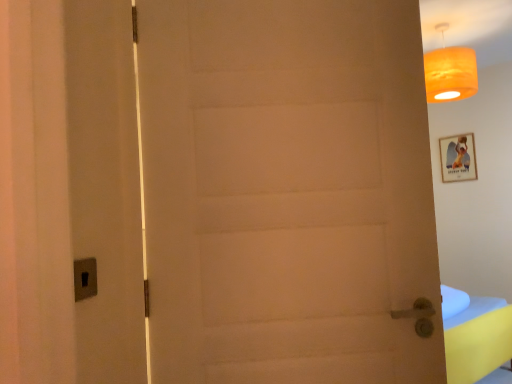
Find the location of a particular element. wooden framed picture at upper right is located at coordinates (458, 158).

This screenshot has height=384, width=512. What are the coordinates of `wooden framed picture at upper right` in the screenshot? It's located at (458, 158).

In the scene shown: Is orange fabric lampshade at upper right at the right side of wooden framed picture at upper right?

Incorrect, orange fabric lampshade at upper right is not on the right side of wooden framed picture at upper right.

Is orange fabric lampshade at upper right in contact with wooden framed picture at upper right?

No, orange fabric lampshade at upper right is not making contact with wooden framed picture at upper right.

The height and width of the screenshot is (384, 512). I want to click on lamp that is in front of the wooden framed picture at upper right, so click(450, 72).

Is orange fabric lampshade at upper right to the right of white matte door at center from the viewer's perspective?

Yes, orange fabric lampshade at upper right is to the right of white matte door at center.

From the image's perspective, would you say orange fabric lampshade at upper right is positioned over white matte door at center?

Yes.

From a real-world perspective, which object rests below the other?

white matte door at center.

Is orange fabric lampshade at upper right in front of or behind white matte door at center in the image?

Clearly, orange fabric lampshade at upper right is behind white matte door at center.

From the picture: Could you tell me if white matte door at center is facing wooden framed picture at upper right?

No, white matte door at center does not turn towards wooden framed picture at upper right.

Does white matte door at center have a lesser width compared to wooden framed picture at upper right?

No, white matte door at center is not thinner than wooden framed picture at upper right.

Is the depth of white matte door at center greater than that of wooden framed picture at upper right?

No, it is in front of wooden framed picture at upper right.

In terms of height, does wooden framed picture at upper right look taller or shorter compared to orange fabric lampshade at upper right?

wooden framed picture at upper right is shorter than orange fabric lampshade at upper right.

Is wooden framed picture at upper right next to orange fabric lampshade at upper right and touching it?

No, wooden framed picture at upper right is not with orange fabric lampshade at upper right.

From the image's perspective, is wooden framed picture at upper right under orange fabric lampshade at upper right?

Yes, from the image's perspective, wooden framed picture at upper right is below orange fabric lampshade at upper right.

Is wooden framed picture at upper right turned away from orange fabric lampshade at upper right?

No, wooden framed picture at upper right's orientation is not away from orange fabric lampshade at upper right.

How distant is white matte door at center from orange fabric lampshade at upper right?

1.77 meters.

Considering the sizes of objects white matte door at center and orange fabric lampshade at upper right in the image provided, who is smaller, white matte door at center or orange fabric lampshade at upper right?

orange fabric lampshade at upper right.

Looking at this image, which is in front, white matte door at center or orange fabric lampshade at upper right?

white matte door at center is closer to the camera.

Do you think white matte door at center is within orange fabric lampshade at upper right, or outside of it?

white matte door at center is not enclosed by orange fabric lampshade at upper right.

Is wooden framed picture at upper right facing towards white matte door at center?

Yes, wooden framed picture at upper right is facing white matte door at center.

From the image's perspective, which object appears higher, wooden framed picture at upper right or white matte door at center?

From the image's view, wooden framed picture at upper right is above.

Which object is positioned more to the right, wooden framed picture at upper right or white matte door at center?

wooden framed picture at upper right.

The image size is (512, 384). Identify the location of lamp that is above the wooden framed picture at upper right (from a real-world perspective). pyautogui.click(x=450, y=72).

Identify the location of door on the left of orange fabric lampshade at upper right. This screenshot has height=384, width=512. (288, 192).

Based on the photo, from the image, which object appears to be nearer to white matte door at center, wooden framed picture at upper right or orange fabric lampshade at upper right?

The object closer to white matte door at center is orange fabric lampshade at upper right.

Based on their spatial positions, is white matte door at center or orange fabric lampshade at upper right further from wooden framed picture at upper right?

The object further to wooden framed picture at upper right is white matte door at center.

From the image, which object appears to be farther from white matte door at center, orange fabric lampshade at upper right or wooden framed picture at upper right?

wooden framed picture at upper right is further to white matte door at center.

When comparing their distances from wooden framed picture at upper right, does orange fabric lampshade at upper right or white matte door at center seem further?

Based on the image, white matte door at center appears to be further to wooden framed picture at upper right.

Considering their positions, is white matte door at center positioned further to orange fabric lampshade at upper right than wooden framed picture at upper right?

Based on the image, white matte door at center appears to be further to orange fabric lampshade at upper right.

When comparing their distances from orange fabric lampshade at upper right, does wooden framed picture at upper right or white matte door at center seem further?

Among the two, white matte door at center is located further to orange fabric lampshade at upper right.

This screenshot has width=512, height=384. Identify the location of lamp between white matte door at center and wooden framed picture at upper right in the front-back direction. (x=450, y=72).